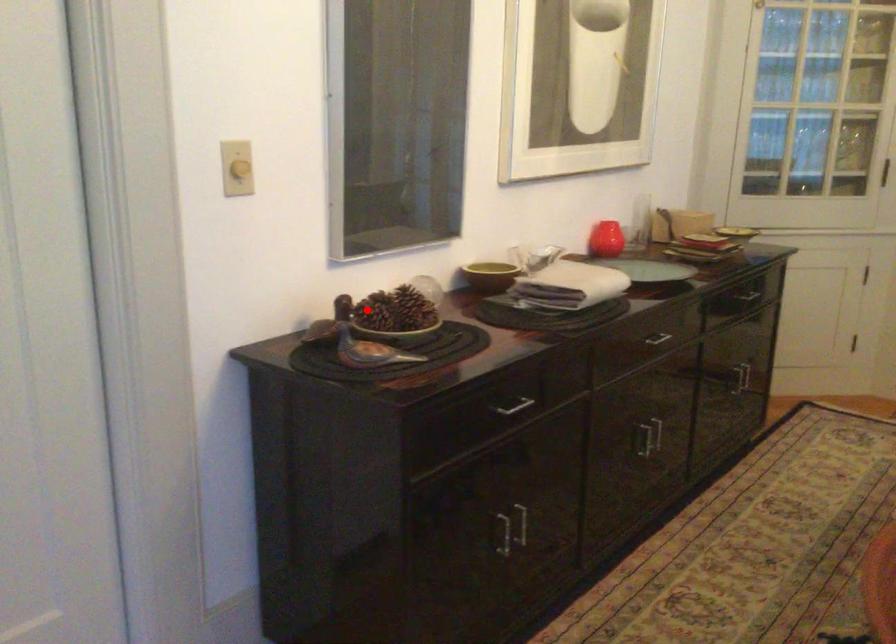
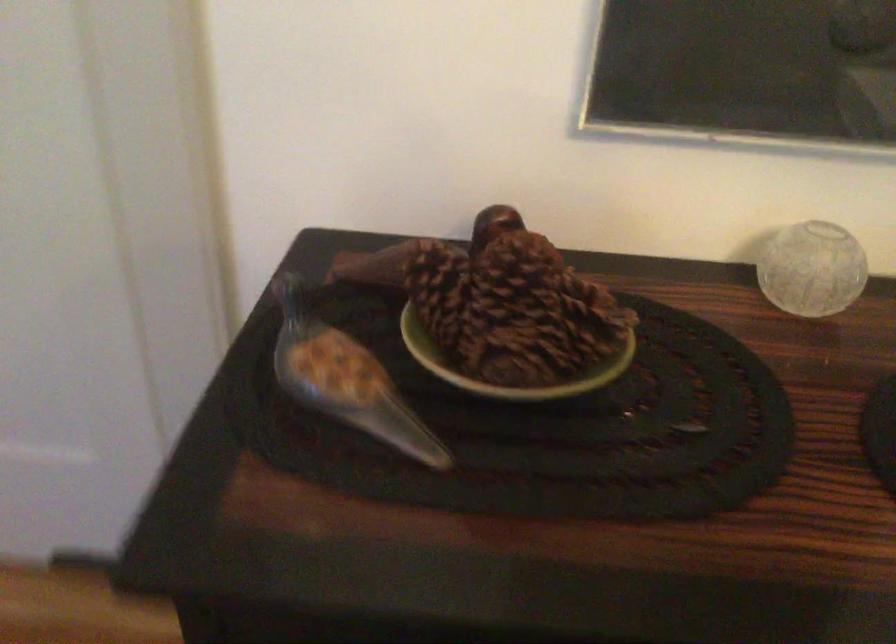
In the second image, find the point that corresponds to the highlighted location in the first image.

(440, 292)